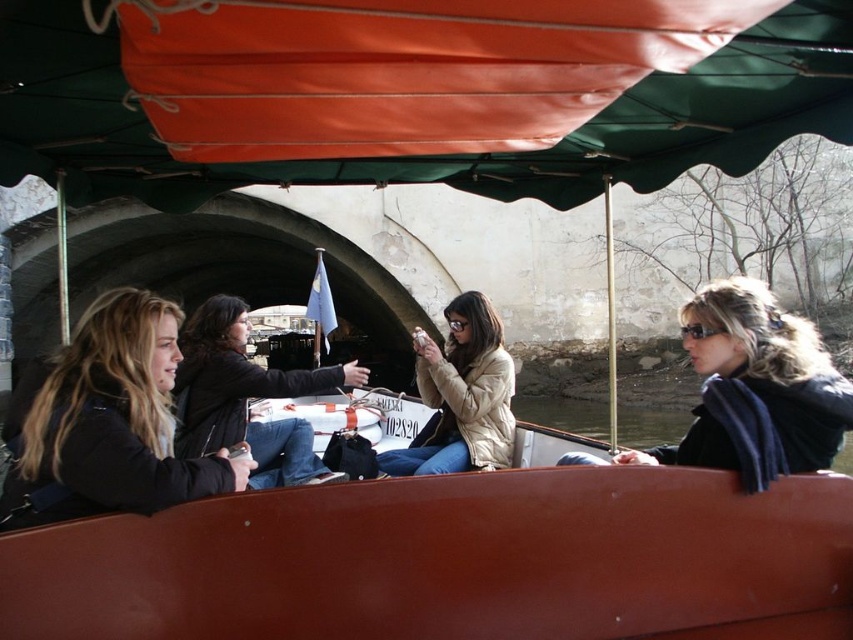
Question: Is the position of orange fabric canopy at upper center less distant than that of dark brown leather jacket at left?

Choices:
 (A) no
 (B) yes

Answer: (B)

Question: Which object is closer to the camera taking this photo?

Choices:
 (A) dark brown leather jacket at left
 (B) smooth brown boat at center
 (C) white fluffy coat at center
 (D) orange fabric canopy at upper center

Answer: (D)

Question: Does dark brown leather jacket at left have a smaller size compared to white fluffy coat at center?

Choices:
 (A) no
 (B) yes

Answer: (A)

Question: Which of these objects is positioned farthest from the dark brown leather jacket at left?

Choices:
 (A) dark brown leather jacket at center
 (B) smooth brown boat at center
 (C) black matte jacket at right
 (D) white fluffy coat at center

Answer: (C)

Question: Estimate the real-world distances between objects in this image. Which object is closer to the orange fabric canopy at upper center?

Choices:
 (A) dark brown leather jacket at left
 (B) white fluffy coat at center
 (C) black matte jacket at right
 (D) smooth brown boat at center

Answer: (D)

Question: Can you confirm if dark brown leather jacket at center is thinner than white fluffy coat at center?

Choices:
 (A) no
 (B) yes

Answer: (A)